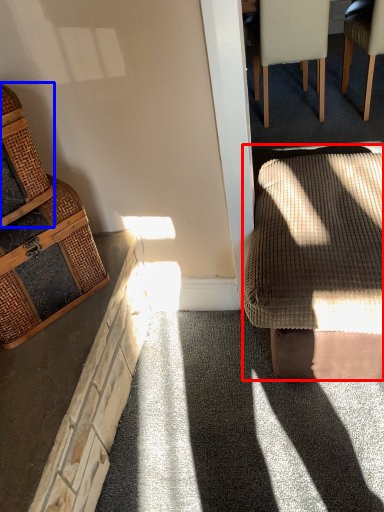
Question: Which point is closer to the camera, rocking chair (highlighted by a red box) or basket (highlighted by a blue box)?

Choices:
 (A) rocking chair
 (B) basket

Answer: (B)